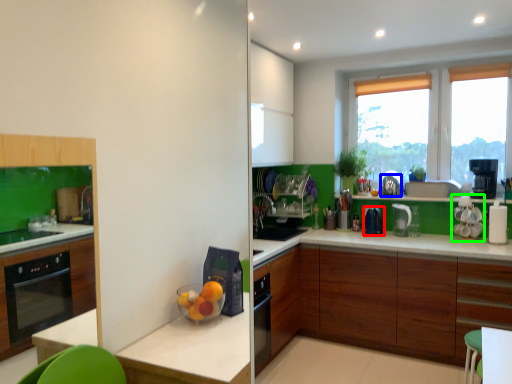
Question: Considering the real-world distances, which object is closest to kitchen appliance (highlighted by a red box)? appliance (highlighted by a blue box) or appliance (highlighted by a green box).

Choices:
 (A) appliance
 (B) appliance

Answer: (A)